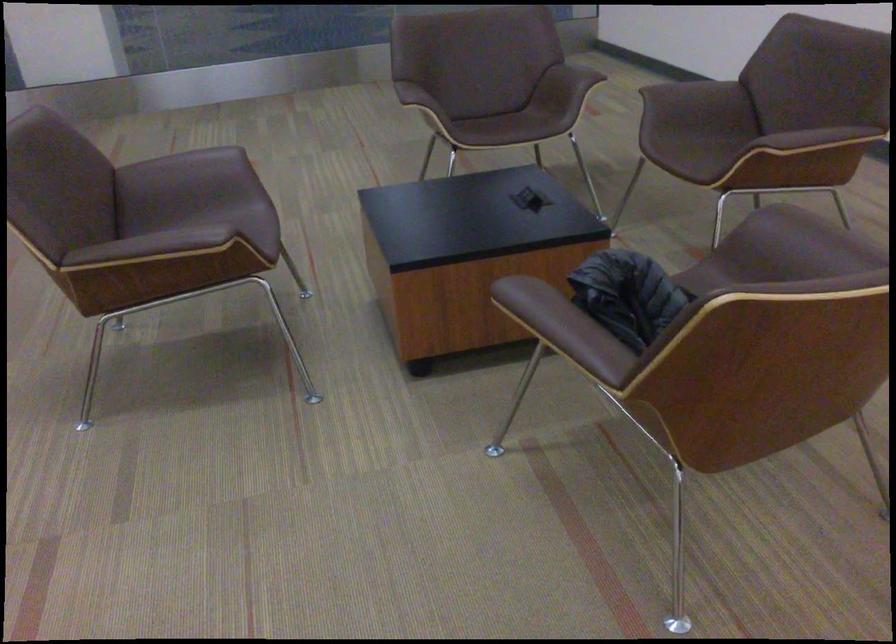
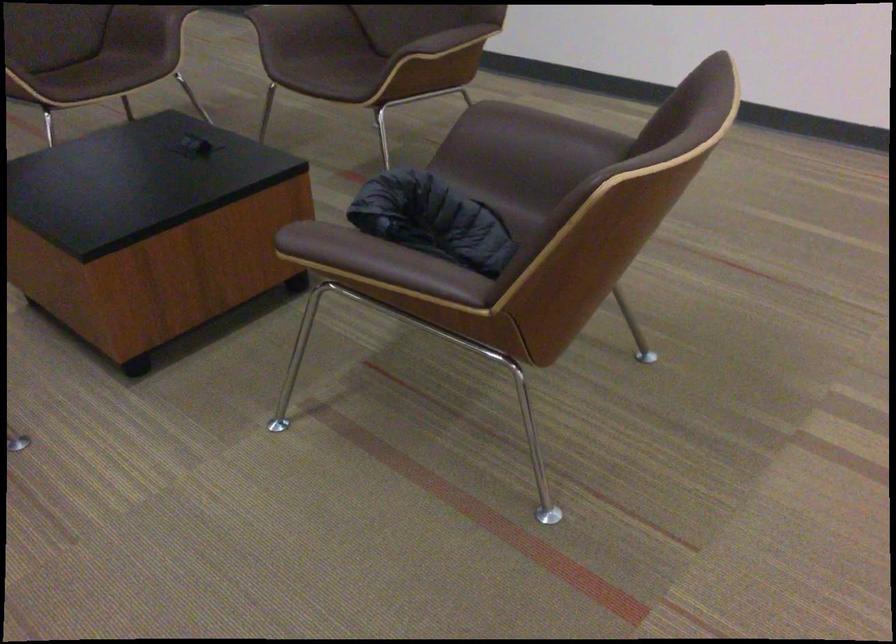
Find the pixel in the second image that matches (790,136) in the first image.

(444, 46)